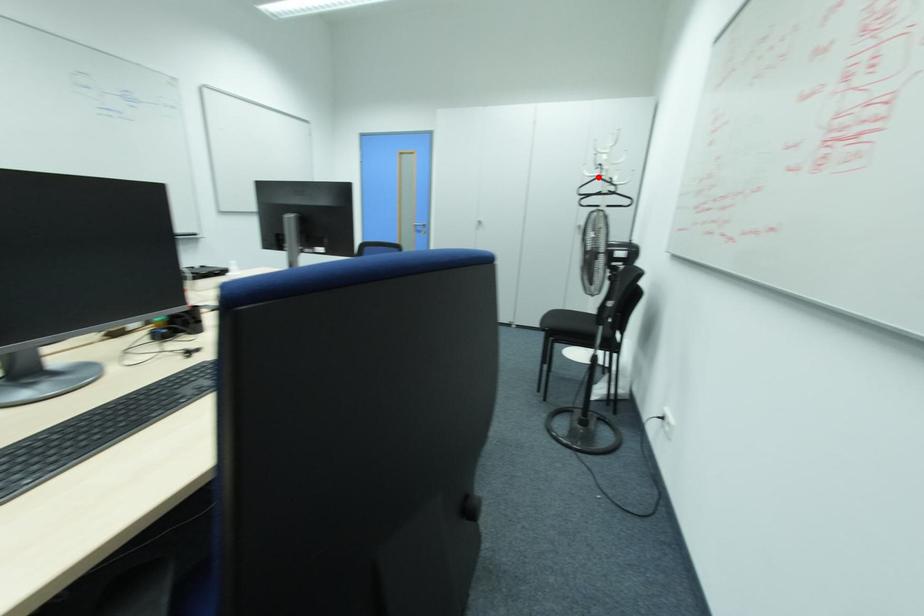
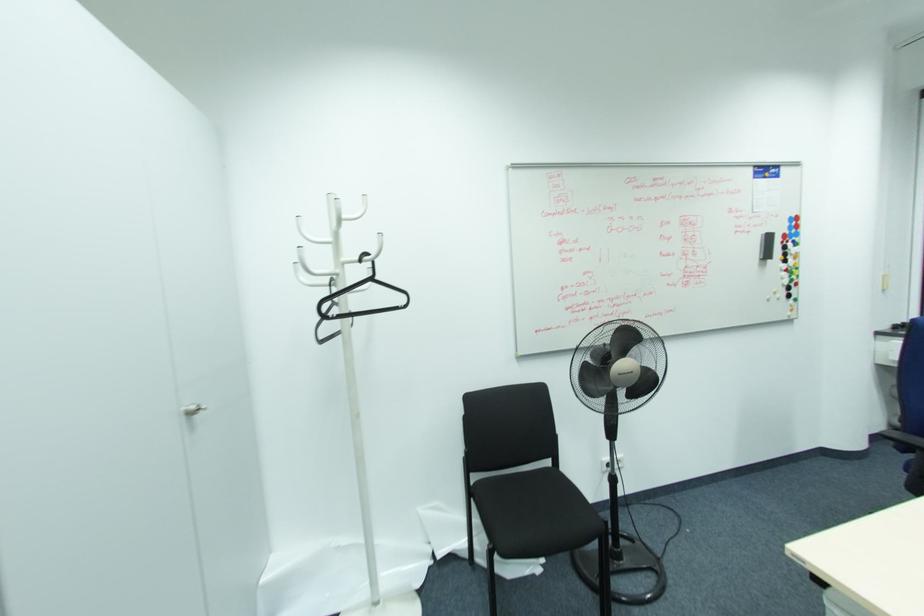
Locate, in the second image, the point that corresponds to the highlighted location in the first image.

(371, 280)